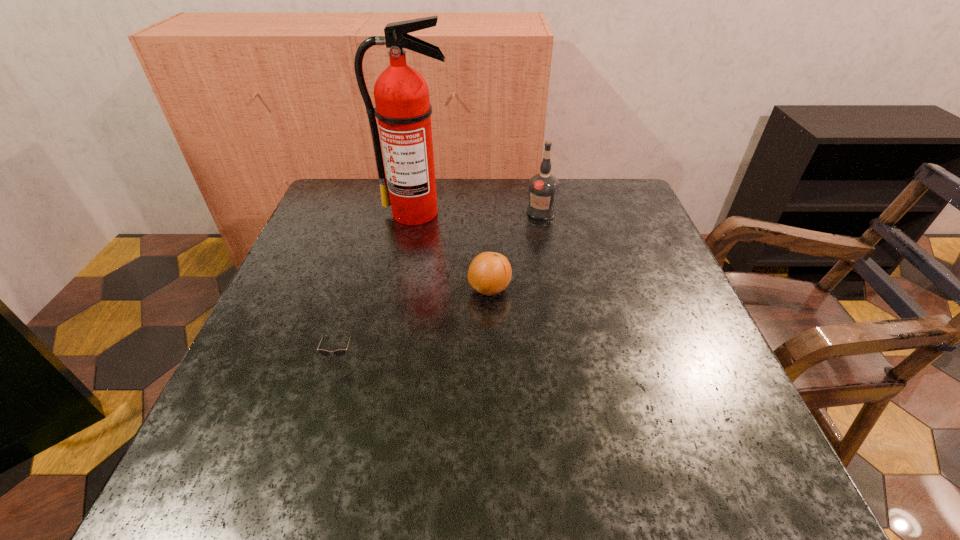
Find the location of a particular element. vacant point located in front of the lenses of the sunglasses is located at coordinates (313, 451).

The image size is (960, 540). Identify the location of fire extinguisher located in the far edge section of the desktop. (403, 109).

I want to click on vodka present at the far edge, so click(x=543, y=187).

Where is `object located in the left edge section of the desktop`? Image resolution: width=960 pixels, height=540 pixels. object located in the left edge section of the desktop is located at coordinates (341, 352).

Where is `vacant space at the far edge of the desktop`? vacant space at the far edge of the desktop is located at coordinates (438, 215).

In the image, there is a desktop. What are the coordinates of `free space at the near edge` in the screenshot? It's located at (599, 468).

This screenshot has width=960, height=540. I want to click on free space at the left edge of the desktop, so click(367, 231).

Where is `free spot at the right edge of the desktop`? The image size is (960, 540). free spot at the right edge of the desktop is located at coordinates (717, 397).

Where is `free space at the far left corner of the desktop`? Image resolution: width=960 pixels, height=540 pixels. free space at the far left corner of the desktop is located at coordinates (350, 189).

The height and width of the screenshot is (540, 960). I want to click on blank area at the far right corner, so click(x=620, y=227).